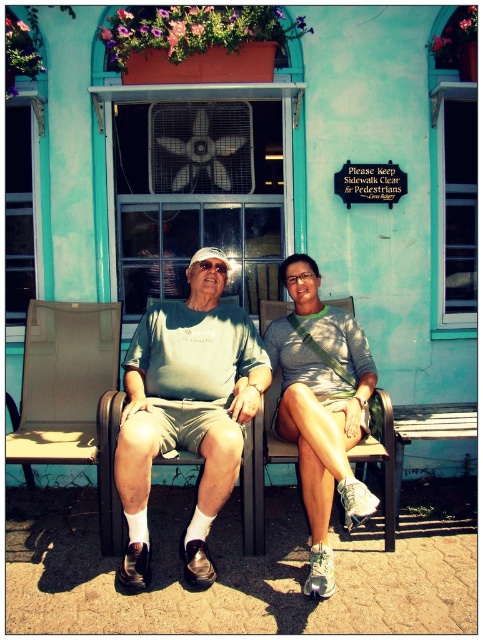
Looking at this image, who is taller, matte green shirt at center or matte gray tank top at center?

matte green shirt at center

What do you see at coordinates (184, 417) in the screenshot? I see `matte green shirt at center` at bounding box center [184, 417].

Does point (137, 365) lie in front of point (293, 422)?

No, (137, 365) is behind (293, 422).

You are a GUI agent. You are given a task and a screenshot of the screen. Output one action in this format:
    pyautogui.click(x=<x>, y=<y>)
    Task: Click on the matte green shirt at center
    The height and width of the screenshot is (640, 483).
    Given the screenshot: What is the action you would take?
    coord(184,417)